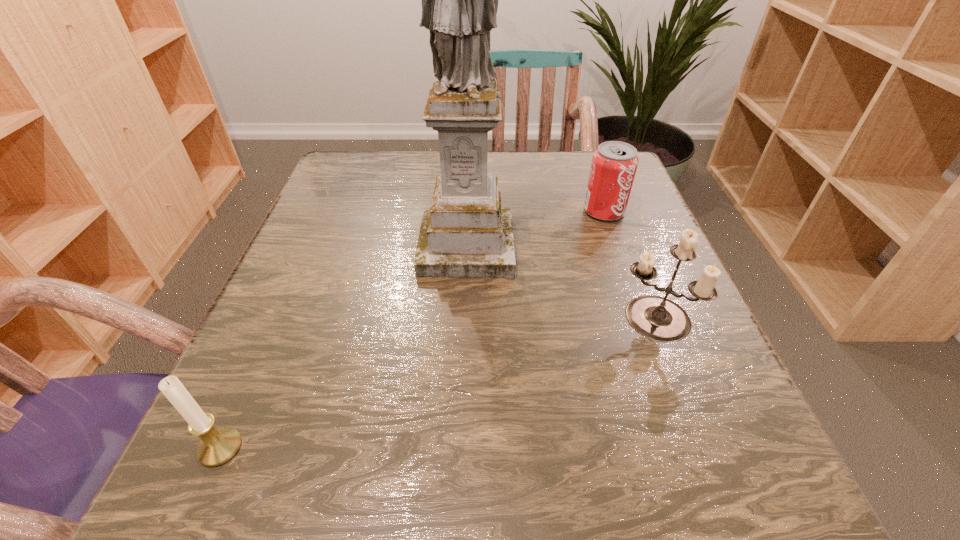
The height and width of the screenshot is (540, 960). I want to click on free region at the left edge, so click(x=330, y=293).

At what (x,y) coordinates should I click in order to perform the action: click on free space at the right edge of the desktop. Please return your answer as a coordinate pair (x, y). This screenshot has width=960, height=540. Looking at the image, I should click on (604, 260).

In order to click on vacant space at the far left corner in this screenshot , I will do `click(380, 168)`.

You are a GUI agent. You are given a task and a screenshot of the screen. Output one action in this format:
    pyautogui.click(x=<x>, y=<y>)
    Task: Click on the free point between the nearer candle holder and the soda can
    Image resolution: width=960 pixels, height=540 pixels.
    Given the screenshot: What is the action you would take?
    pyautogui.click(x=412, y=329)

Find the location of a particular element. The width and height of the screenshot is (960, 540). free spot between the farther candle holder and the sculpture is located at coordinates (560, 282).

Where is `empty space between the leftmost object and the third object from right to left`? This screenshot has height=540, width=960. empty space between the leftmost object and the third object from right to left is located at coordinates (344, 347).

Locate an element on the screen. free point between the soda can and the sculpture is located at coordinates (535, 229).

The image size is (960, 540). Find the location of `vacant area that lies between the nearer candle holder and the right candle holder`. vacant area that lies between the nearer candle holder and the right candle holder is located at coordinates (437, 383).

The height and width of the screenshot is (540, 960). Find the location of `empty location between the second object from left to right and the right candle holder`. empty location between the second object from left to right and the right candle holder is located at coordinates (560, 282).

Identify the location of empty space that is in between the nearest object and the farther candle holder. (437, 383).